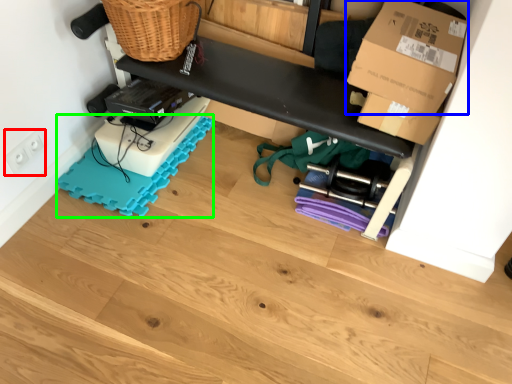
Question: Estimate the real-world distances between objects in this image. Which object is closer to electric outlet (highlighted by a red box), box (highlighted by a blue box) or yoga mat (highlighted by a green box)?

Choices:
 (A) box
 (B) yoga mat

Answer: (B)